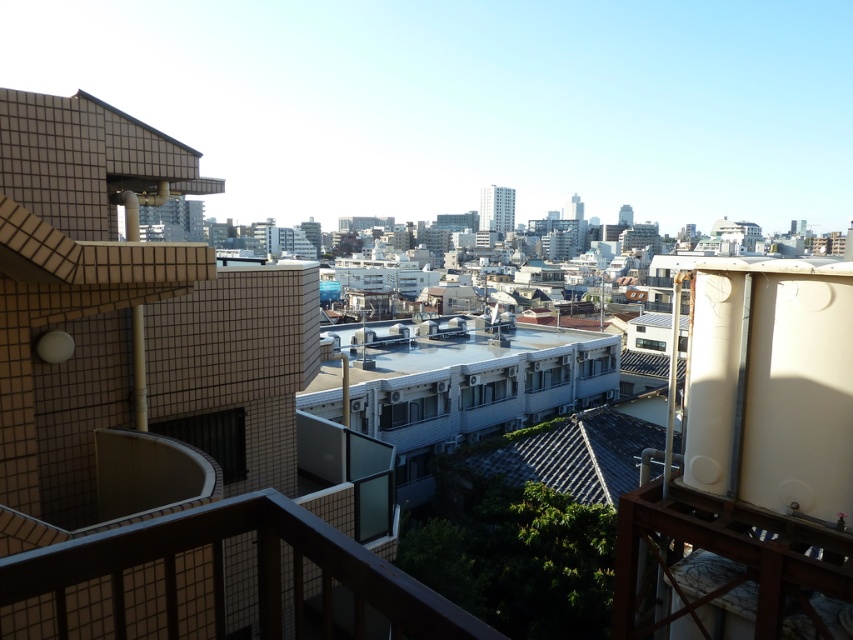
Question: Which point is closer to the camera?

Choices:
 (A) (440, 362)
 (B) (599, 464)

Answer: (B)

Question: Is white smooth roof at center thinner than gray tile roof at center?

Choices:
 (A) yes
 (B) no

Answer: (B)

Question: Is white smooth roof at center positioned in front of gray tile roof at center?

Choices:
 (A) yes
 (B) no

Answer: (B)

Question: Is the position of white smooth roof at center less distant than that of gray tile roof at center?

Choices:
 (A) no
 (B) yes

Answer: (A)

Question: Which object appears closest to the camera in this image?

Choices:
 (A) gray tile roof at center
 (B) white smooth roof at center

Answer: (A)